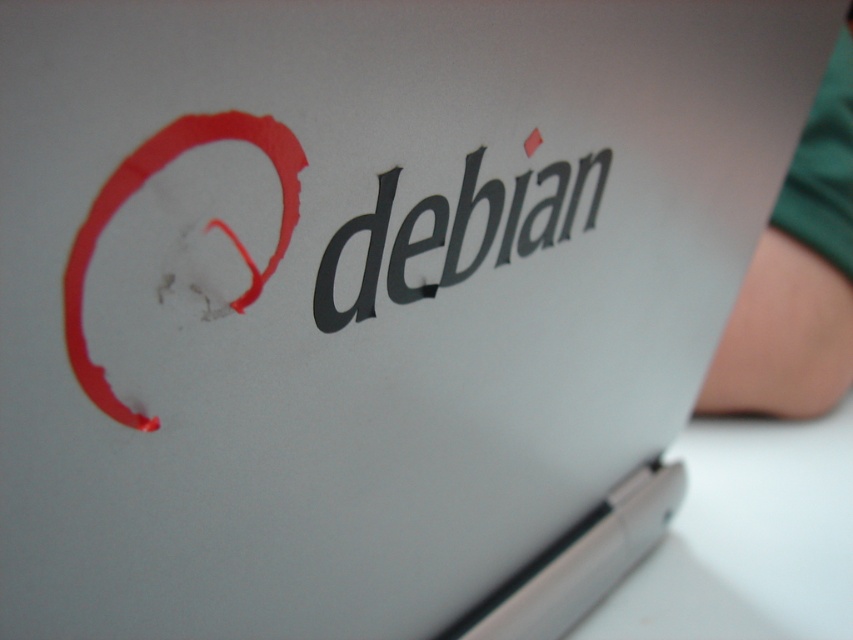
Question: Does black matte/debossed text at center lie behind matte red circle at upper left?

Choices:
 (A) yes
 (B) no

Answer: (A)

Question: Which point is farther to the camera?

Choices:
 (A) (129, 420)
 (B) (457, 205)

Answer: (B)

Question: Is black matte/debossed text at center thinner than matte red circle at upper left?

Choices:
 (A) yes
 (B) no

Answer: (B)

Question: Does black matte/debossed text at center lie in front of matte red circle at upper left?

Choices:
 (A) yes
 (B) no

Answer: (B)